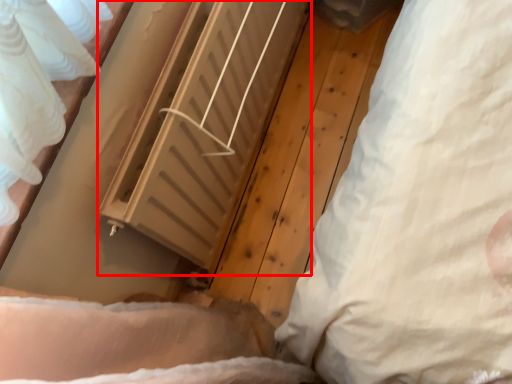
Question: Where is radiator (annotated by the red box) located in relation to pillow in the image?

Choices:
 (A) left
 (B) right

Answer: (A)